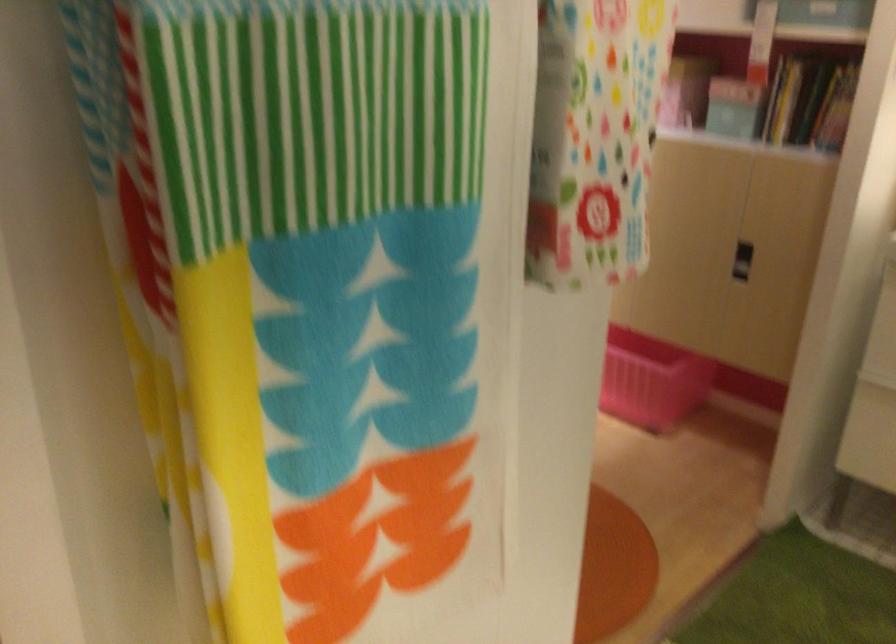
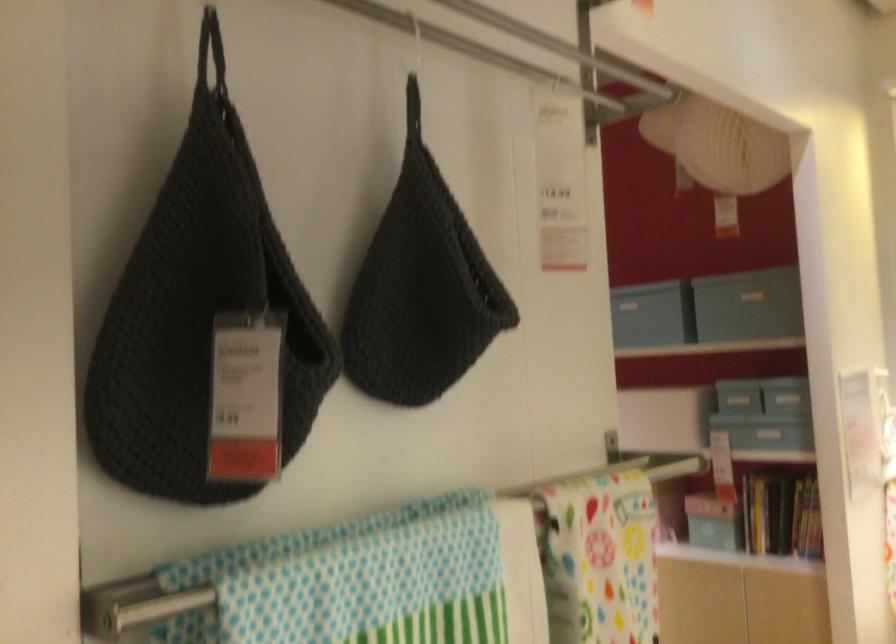
Question: How did the camera likely rotate?

Choices:
 (A) Left
 (B) Right
 (C) Up
 (D) Down

Answer: (C)